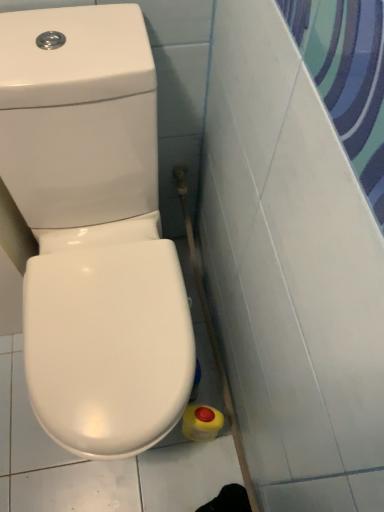
Question: In terms of size, does yellow matte bottle at lower right appear bigger or smaller than white glossy toilet at lower left?

Choices:
 (A) small
 (B) big

Answer: (A)

Question: Considering the positions of yellow matte bottle at lower right and white glossy toilet at lower left in the image, is yellow matte bottle at lower right taller or shorter than white glossy toilet at lower left?

Choices:
 (A) short
 (B) tall

Answer: (A)

Question: In the image, is yellow matte bottle at lower right positioned in front of or behind white glossy toilet at lower left?

Choices:
 (A) behind
 (B) front

Answer: (A)

Question: Is point (39, 20) positioned closer to the camera than point (208, 406)?

Choices:
 (A) closer
 (B) farther

Answer: (A)

Question: Considering their positions, is white glossy toilet at lower left located in front of or behind yellow matte bottle at lower right?

Choices:
 (A) behind
 (B) front

Answer: (B)

Question: From the image's perspective, is white glossy toilet at lower left above or below yellow matte bottle at lower right?

Choices:
 (A) above
 (B) below

Answer: (A)

Question: Considering the positions of white glossy toilet at lower left and yellow matte bottle at lower right in the image, is white glossy toilet at lower left wider or thinner than yellow matte bottle at lower right?

Choices:
 (A) thin
 (B) wide

Answer: (B)